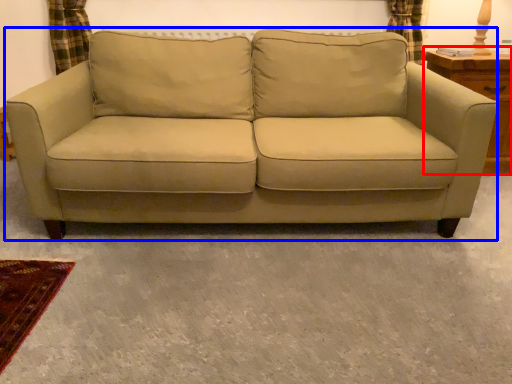
Question: Which object is further to the camera taking this photo, dresser (highlighted by a red box) or studio couch (highlighted by a blue box)?

Choices:
 (A) dresser
 (B) studio couch

Answer: (A)